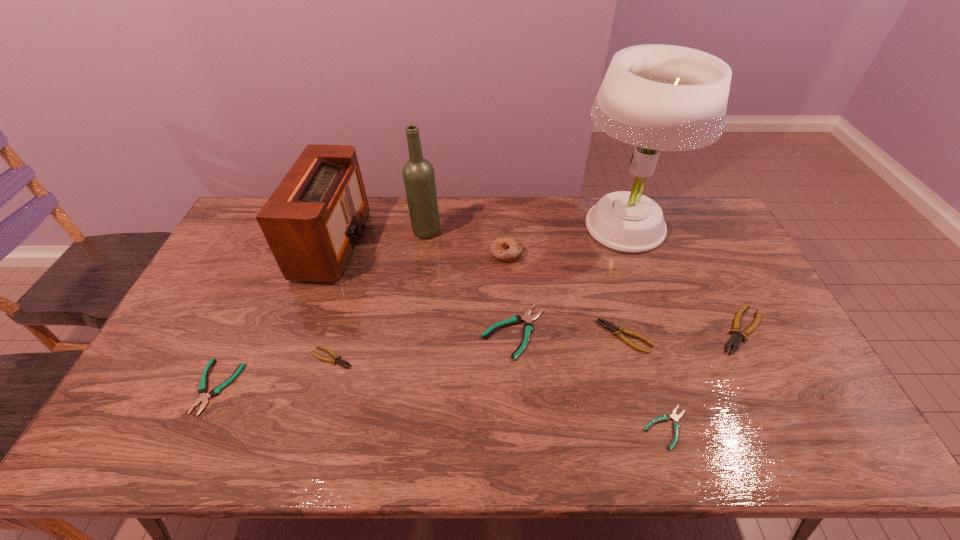
Locate an element on the screen. The width and height of the screenshot is (960, 540). the tallest object is located at coordinates (656, 97).

The height and width of the screenshot is (540, 960). Find the location of `lamp`. lamp is located at coordinates (656, 97).

The image size is (960, 540). Find the location of `the second tallest object`. the second tallest object is located at coordinates (418, 173).

Image resolution: width=960 pixels, height=540 pixels. Find the location of `the seventh object from right to left`. the seventh object from right to left is located at coordinates (418, 173).

Identify the location of the eighth shortest object. This screenshot has height=540, width=960. point(312,222).

Find the location of a particular element. the fourth tallest object is located at coordinates (507, 249).

Identify the location of the fifth tallest object. The width and height of the screenshot is (960, 540). (735, 339).

Where is `the rightmost yellow pliers`? This screenshot has height=540, width=960. the rightmost yellow pliers is located at coordinates (735, 339).

Where is `the second teal pliers from left to right`? This screenshot has height=540, width=960. the second teal pliers from left to right is located at coordinates (527, 318).

This screenshot has height=540, width=960. Find the location of `the biggest teal pliers`. the biggest teal pliers is located at coordinates (527, 318).